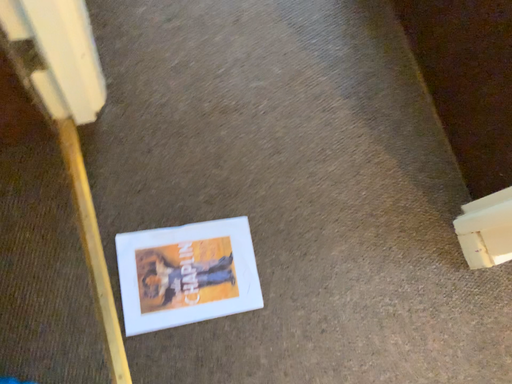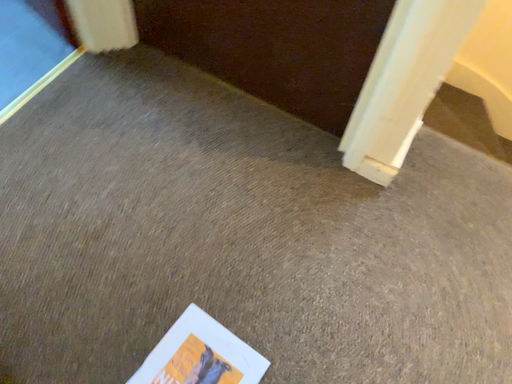
Question: How did the camera likely rotate when shooting the video?

Choices:
 (A) rotated left
 (B) rotated right

Answer: (B)